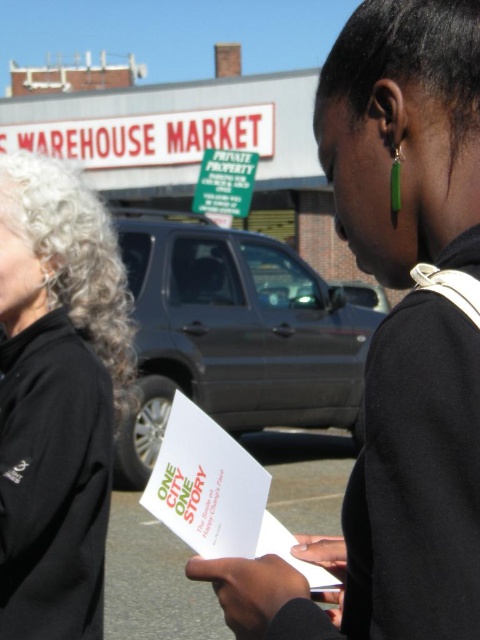
Between matte black paper at center and black fleece jacket at left, which one has more height?

black fleece jacket at left

Can you confirm if matte black paper at center is wider than black fleece jacket at left?

Correct, the width of matte black paper at center exceeds that of black fleece jacket at left.

You are a GUI agent. You are given a task and a screenshot of the screen. Output one action in this format:
    pyautogui.click(x=<x>, y=<y>)
    Task: Click on the matte black paper at center
    
    Given the screenshot: What is the action you would take?
    pyautogui.click(x=388, y=502)